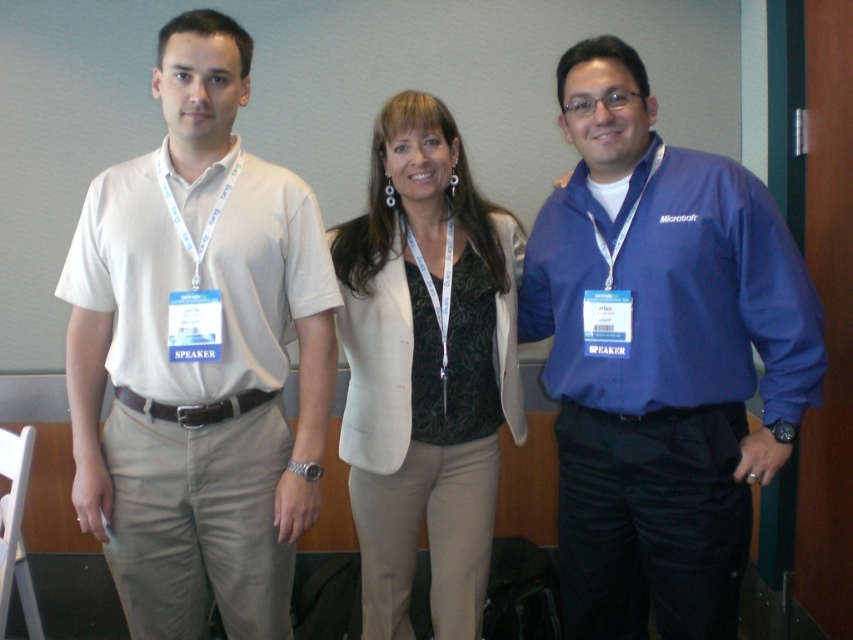
Based on the photo, you are a photographer who needs to adjust the distance between the matte white shirt at left and the camera to ensure proper framing. Currently, they are 1.54 meters apart. If the ideal distance for a headshot is between 1.2 to 1.4 meters, should you move the camera closer or farther away?

The current distance between the matte white shirt at left and the camera is 1.54 meters, which is slightly beyond the ideal range of 1.2 to 1.4 meters. To achieve proper framing for a headshot, you should move the camera closer to the matte white shirt at left by approximately 0.14 meters.

You are organizing a photo shoot and need to place two speakers side by side on a stage. The stage has a 1.2 meter wide platform. The matte white shirt at left and the blue fabric shirt at right are the two speakers. Can both speakers stand side by side on the platform without overlapping?

The matte white shirt at left might be wider than blue fabric shirt at right. If the combined width of both speakers exceeds 1.2 meters, they might not fit. However, since the exact widths aren not provided, it is uncertain whether they can stand side by side without overlapping.